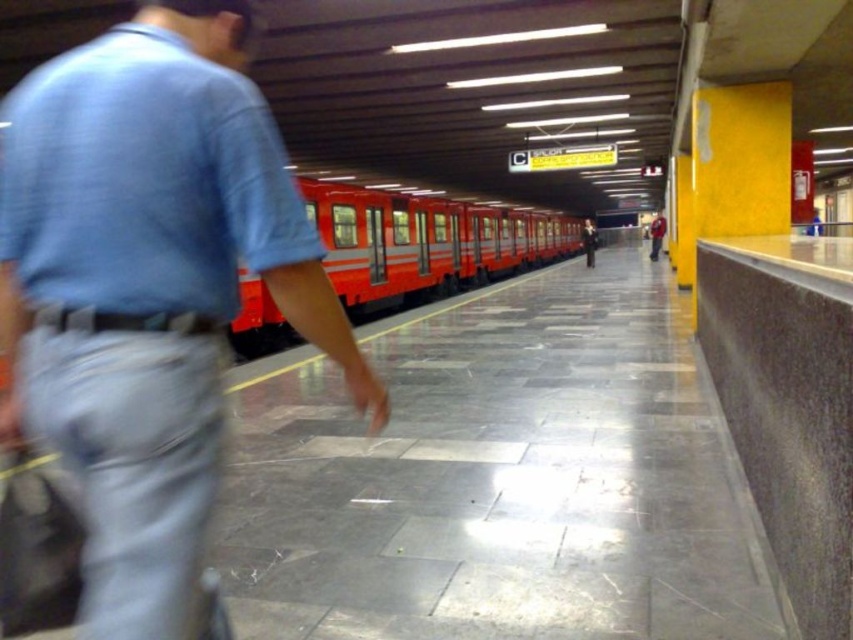
You are standing on the subway platform and see the denim jeans at left and the shiny red train at center. Which object is nearer to you?

The denim jeans at left is closer to the viewer than the shiny red train at center.

You are standing on the subway platform and want to find the denim jeans at left. According to the scene description, where would you look relative to the platform?

The denim jeans at left are located at the point 0.450 on the x axis and 0.175 on the y axis relative to the platform.

You are standing on the subway platform and see the denim jeans at left and the shiny red train at center. If you want to board the train before it departs, which object should you move towards and why?

You should move towards the shiny red train at center because the denim jeans at left is 11.81 meters away from it. Since the train is the destination for boarding, moving towards the train ensures you can board before departure.